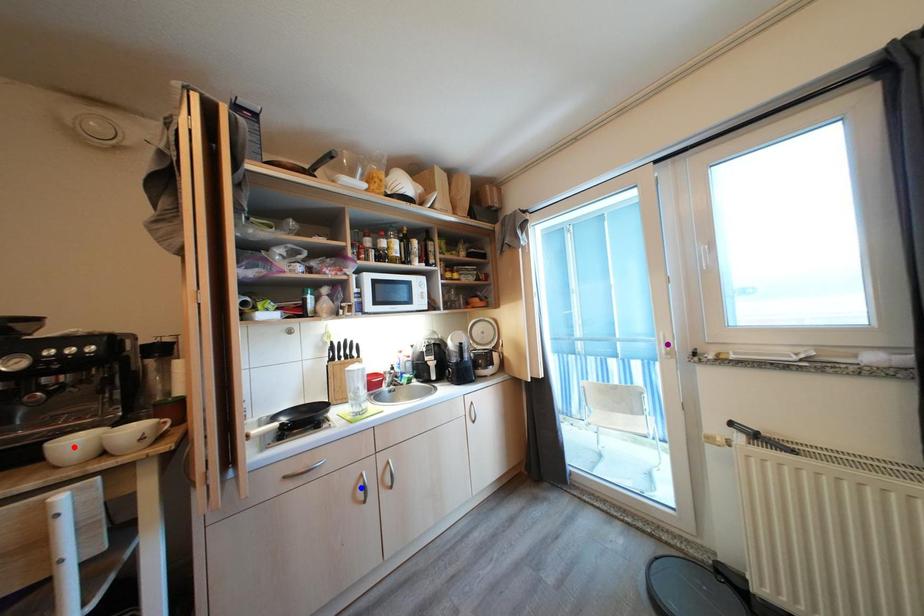
Order these from nearest to farthest:
red point
purple point
blue point

purple point < blue point < red point